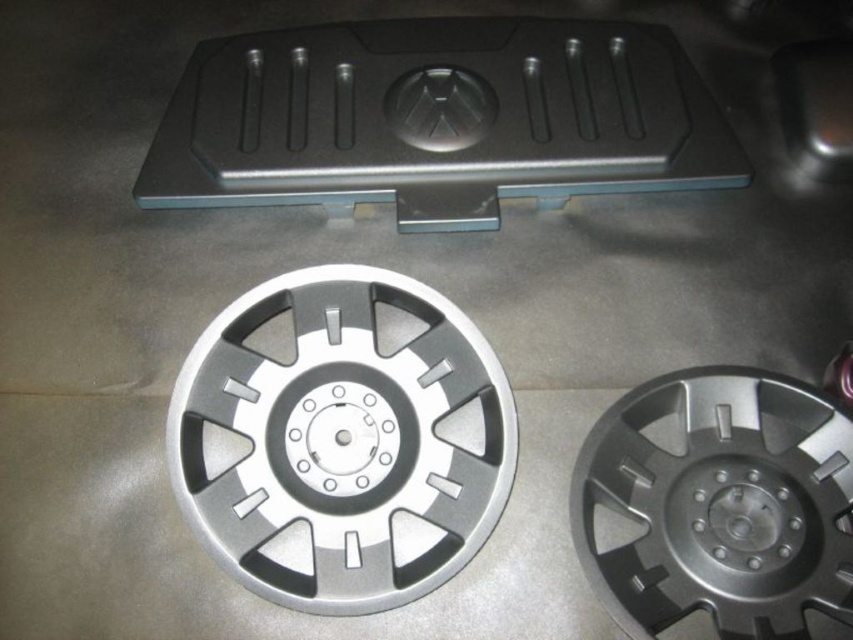
You are a mechanic inspecting the car undercarriage. You notice two points marked on the image. The first point is at coordinate point (236,125) and the second is at point (724,406). Which point is closer to you as you look at the undercarriage?

Point (236,125) is closer to you than point (724,406) because it is further to the camera.

You are a mechanic inspecting a car undercarriage. You notice the black plastic cover at center and the silver metallic wheel at center. Which object would you need to lift first to access the brake line located underneath them?

The black plastic cover at center is bigger than the silver metallic wheel at center, so you should lift the black plastic cover at center first to access the brake line located underneath them.

You are a mechanic inspecting the car undercarriage. You need to place a tool box between the black plastic cover at center and the silver metallic hubcap at center. Which object should you move to create space?

The black plastic cover at center has a larger width than the silver metallic hubcap at center. To create space for the tool box, you should move the black plastic cover at center since it occupies more horizontal space.